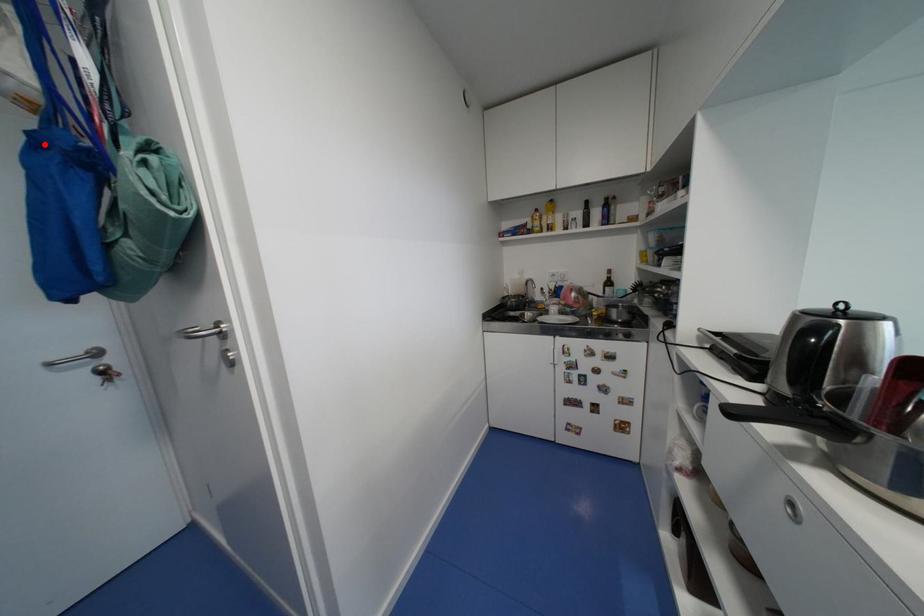
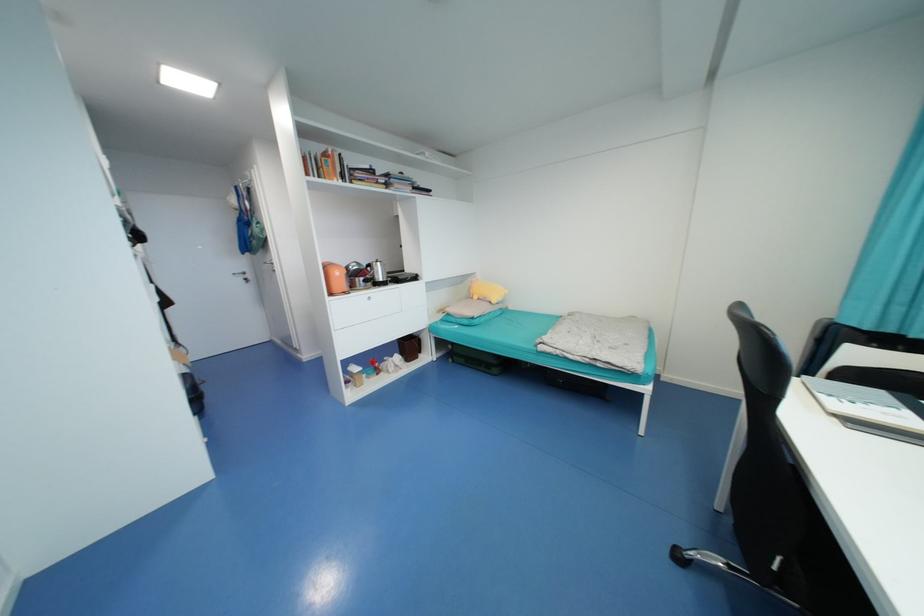
Question: I am providing you with two images of the same scene from different viewpoints. A red point is marked on the first image. At the location where the point appears in image 1, is it still visible in image 2?

Choices:
 (A) Yes
 (B) No

Answer: (A)